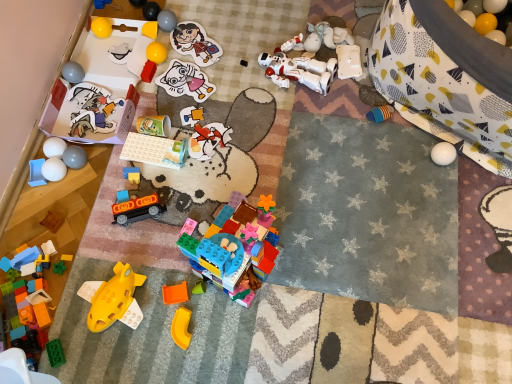
Locate an element on the screen. The image size is (512, 384). free space in front of yellow matte plastic arch at center, which appears as the 21th toy when viewed from the left is located at coordinates (179, 367).